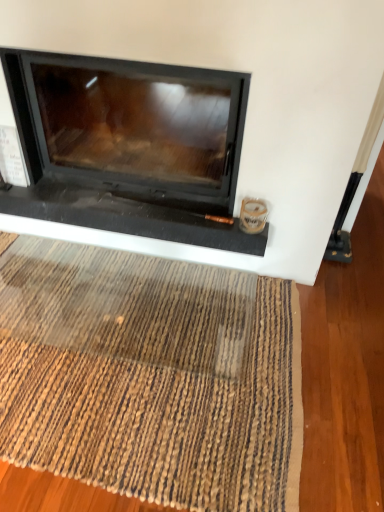
Locate an element on the screen. The width and height of the screenshot is (384, 512). vacant space underneath brown woven mat at lower center (from a real-world perspective) is located at coordinates (123, 338).